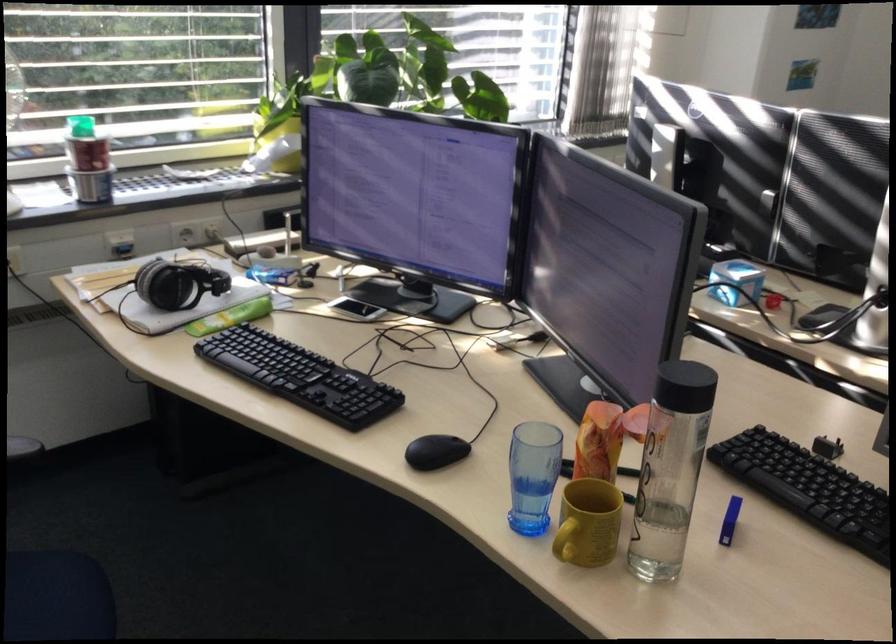
Where is `blue and white cube`? This screenshot has width=896, height=644. blue and white cube is located at coordinates (735, 281).